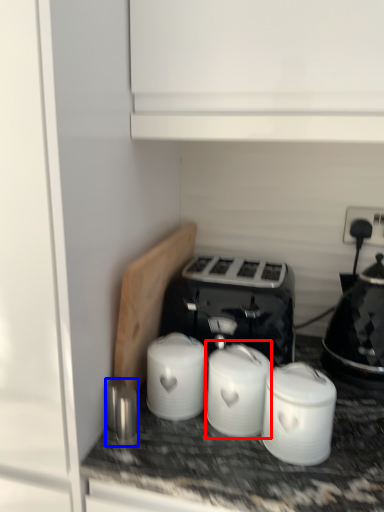
Question: Which object appears farthest to the camera in this image, appliance (highlighted by a red box) or appliance (highlighted by a blue box)?

Choices:
 (A) appliance
 (B) appliance

Answer: (B)